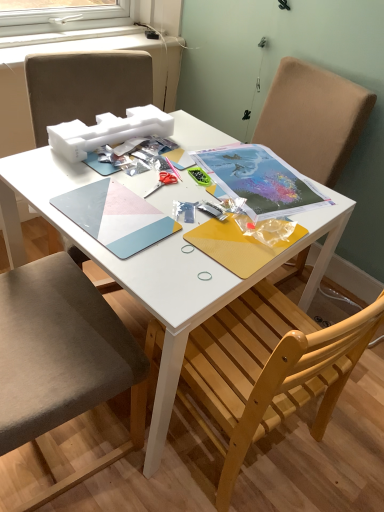
You are a GUI agent. You are given a task and a screenshot of the screen. Output one action in this format:
    pyautogui.click(x=<x>, y=<y>)
    Task: Click on the spots to the right of metallic silver scissors at center
    
    Given the screenshot: What is the action you would take?
    pyautogui.click(x=215, y=195)